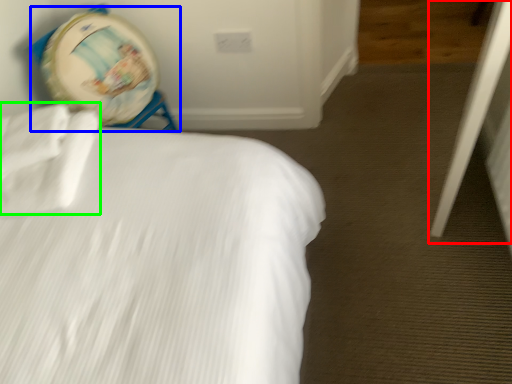
Question: Considering the real-world distances, which object is farthest from screen door (highlighted by a red box)? swivel chair (highlighted by a blue box) or sheet (highlighted by a green box)?

Choices:
 (A) swivel chair
 (B) sheet

Answer: (A)